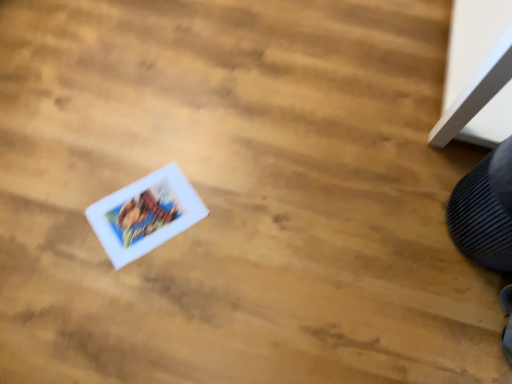
This screenshot has height=384, width=512. I want to click on free point behind white matte comic book at center, so click(x=162, y=145).